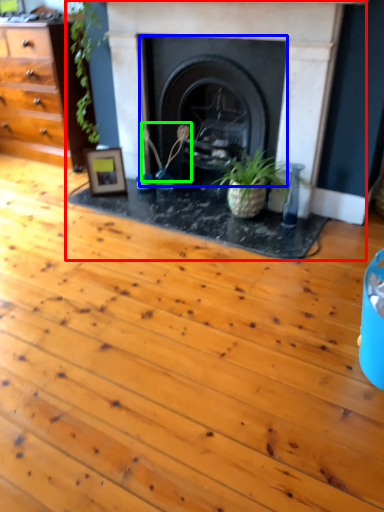
Question: Estimate the real-world distances between objects in this image. Which object is farther from fireplace (highlighted by a red box), fireplace (highlighted by a blue box) or plant (highlighted by a green box)?

Choices:
 (A) fireplace
 (B) plant

Answer: (B)